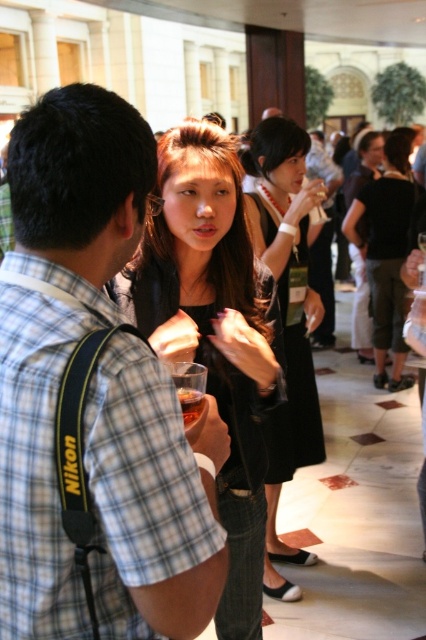
Does matte black jacket at center have a lesser width compared to black dress at center?

Incorrect, matte black jacket at center's width is not less than black dress at center's.

Which is more to the right, matte black jacket at center or black dress at center?

black dress at center is more to the right.

Is point (249, 554) farther from camera compared to point (313, 387)?

No, it is not.

I want to click on matte black jacket at center, so click(215, 333).

Can you confirm if black leather jacket at center is taller than translucent plastic cup at center?

Indeed, black leather jacket at center has a greater height compared to translucent plastic cup at center.

Does black leather jacket at center appear under translucent plastic cup at center?

Actually, black leather jacket at center is above translucent plastic cup at center.

The height and width of the screenshot is (640, 426). Find the location of `black leather jacket at center`. black leather jacket at center is located at coordinates (385, 253).

Which is more to the left, plaid cotton shirt at center or translucent plastic cup at center?

Positioned to the left is plaid cotton shirt at center.

Is plaid cotton shirt at center positioned before translucent plastic cup at center?

Yes, plaid cotton shirt at center is closer to the viewer.

Is point (143, 152) in front of point (192, 404)?

Yes, point (143, 152) is in front of point (192, 404).

Locate an element on the screen. The image size is (426, 640). plaid cotton shirt at center is located at coordinates (152, 500).